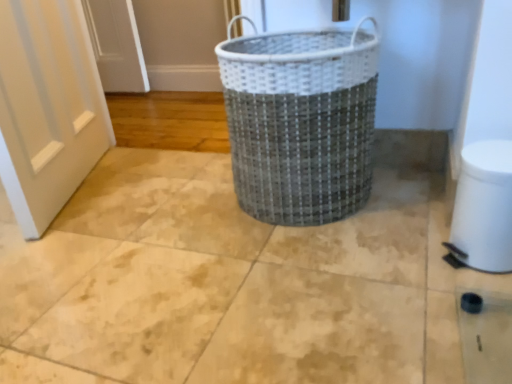
Where is `empty space that is in between metallic woven basket at center and white plastic toilet bowl at lower right`? The height and width of the screenshot is (384, 512). empty space that is in between metallic woven basket at center and white plastic toilet bowl at lower right is located at coordinates (389, 227).